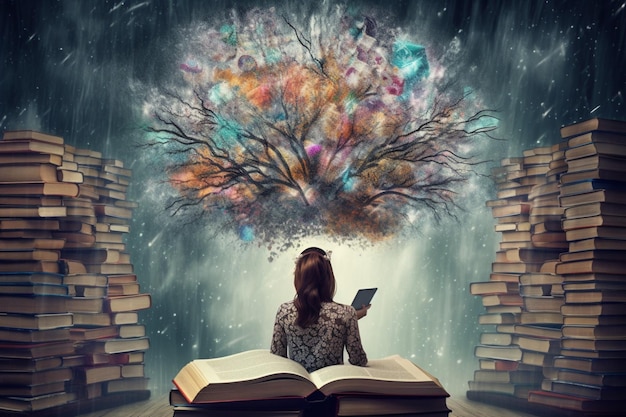
Identify the location of piles of books. This screenshot has width=626, height=417. click(x=64, y=272), click(x=575, y=265).